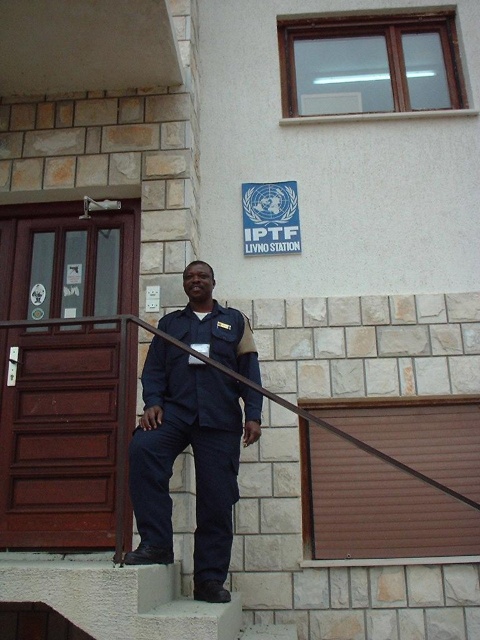
You are a delivery person who needs to place a package on the concrete at center without touching the dark blue uniform at center. What is the minimum distance you should maintain between the package and the uniform?

The dark blue uniform at center is 27.24 inches away from the concrete at center. To place the package on the concrete at center without touching the uniform, you should maintain at least 27.24 inches of distance between them.

You are a designer tasked with creating a uniform for the IPTF Livno Station. Based on the scene, which object is bigger in size between the dark blue uniform at center and the concrete at center?

The dark blue uniform at center is larger in size than the concrete at center.

Looking at this image, you are a designer creating a layout for a IPTF Livno Station promotional poster. You need to place the dark blue uniform at center and the concrete at center on the poster. Which object should you make wider to ensure the poster maintains a balanced look?

The concrete at center should be made wider since the dark blue uniform at center has a lesser width compared to concrete at center, so balancing their widths would help maintain visual harmony.